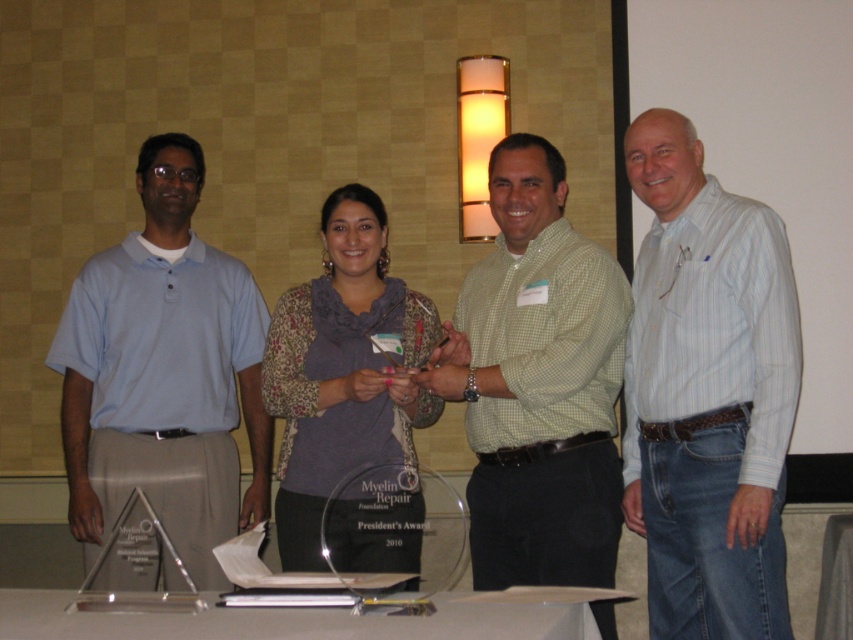
Question: Does white striped shirt at right appear on the left side of clear acrylic table at center?

Choices:
 (A) no
 (B) yes

Answer: (A)

Question: Estimate the real-world distances between objects in this image. Which object is farther from the clear acrylic table at center?

Choices:
 (A) light blue polo shirt at left
 (B) green checkered shirt at center

Answer: (A)

Question: Is light blue polo shirt at left closer to camera compared to floral-patterned sweater at center?

Choices:
 (A) no
 (B) yes

Answer: (A)

Question: Which object is closer to the camera taking this photo?

Choices:
 (A) clear acrylic table at center
 (B) light blue polo shirt at left
 (C) white striped shirt at right

Answer: (A)

Question: Does white striped shirt at right have a smaller size compared to light blue polo shirt at left?

Choices:
 (A) no
 (B) yes

Answer: (B)

Question: Estimate the real-world distances between objects in this image. Which object is farther from the green checkered shirt at center?

Choices:
 (A) floral-patterned sweater at center
 (B) light blue polo shirt at left
 (C) white striped shirt at right
 (D) clear acrylic table at center

Answer: (B)